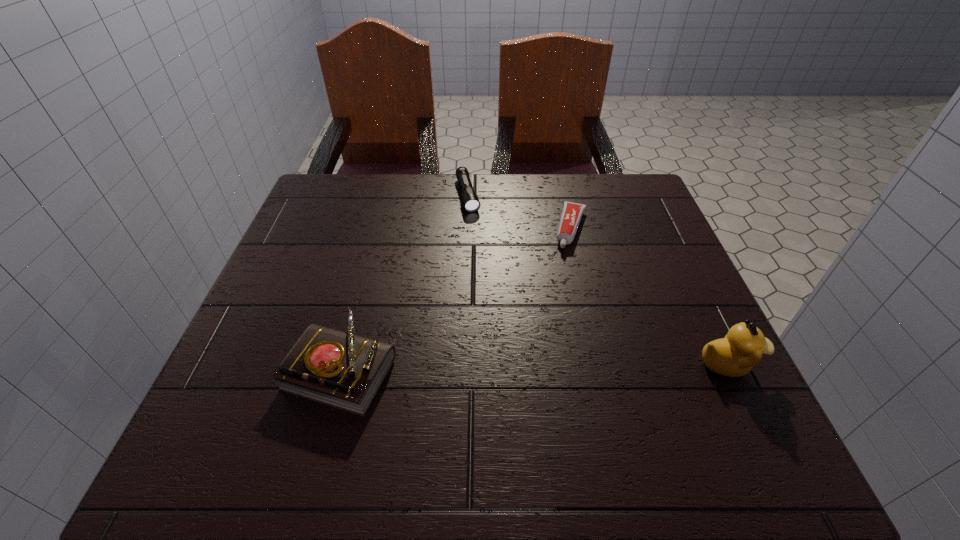
Locate an element on the screen. diary is located at coordinates (342, 370).

In order to click on the second tallest object in this screenshot , I will do `click(342, 370)`.

The image size is (960, 540). Find the location of `the rightmost object`. the rightmost object is located at coordinates point(734,355).

This screenshot has width=960, height=540. In order to click on duckling in this screenshot , I will do `click(734, 355)`.

What are the coordinates of `the third object from left to right` in the screenshot? It's located at (572, 212).

What are the coordinates of `the shortest object` in the screenshot? It's located at (572, 212).

You are a GUI agent. You are given a task and a screenshot of the screen. Output one action in this format:
    pyautogui.click(x=<x>, y=<y>)
    Task: Click on the second object from left to right
    The image size is (960, 540).
    Given the screenshot: What is the action you would take?
    pyautogui.click(x=470, y=200)

Where is `vacant space located 0.120m on the right of the second tallest object`? Image resolution: width=960 pixels, height=540 pixels. vacant space located 0.120m on the right of the second tallest object is located at coordinates (462, 367).

Locate an element on the screen. The image size is (960, 540). free region located at the nozzle of the toothpaste is located at coordinates (556, 306).

This screenshot has width=960, height=540. Find the location of `vacant region located 0.210m at the nozzle of the toothpaste`. vacant region located 0.210m at the nozzle of the toothpaste is located at coordinates (553, 316).